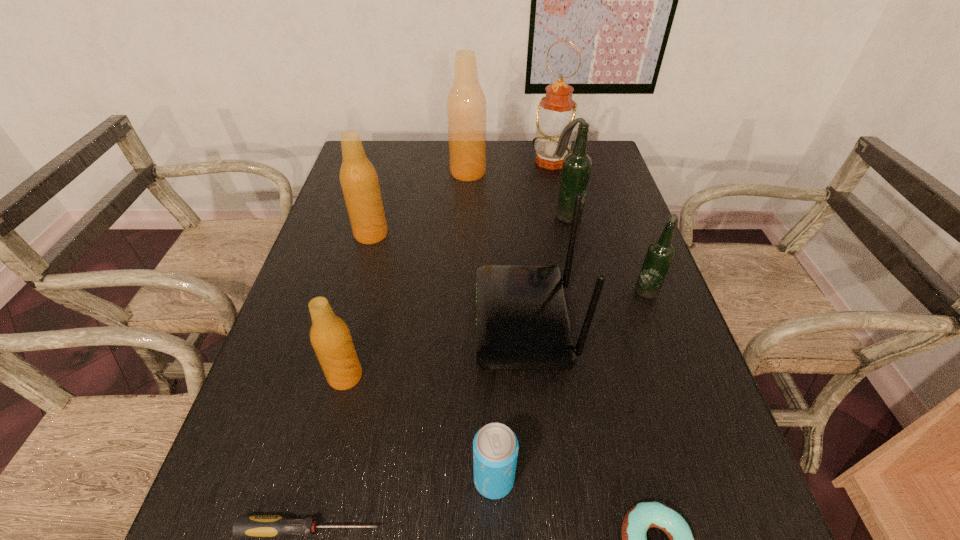
Locate which tan beer bottle is the second closest to the router. Please provide its 2D coordinates. Your answer should be formatted as a tuple, i.e. [(x, y)], where the tuple contains the x and y coordinates of a point satisfying the conditions above.

[(359, 181)]